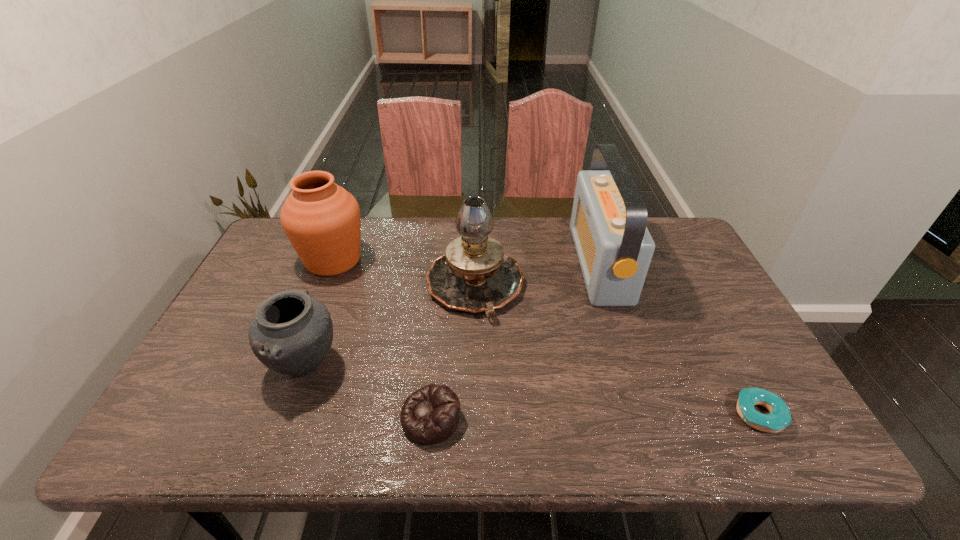
Find the location of `doughnut that is at the near edge`. doughnut that is at the near edge is located at coordinates (779, 417).

At what (x,y) coordinates should I click in order to perform the action: click on object that is at the left edge. Please return your answer as a coordinate pair (x, y). The width and height of the screenshot is (960, 540). Looking at the image, I should click on (322, 221).

Where is `object present at the right edge`? Image resolution: width=960 pixels, height=540 pixels. object present at the right edge is located at coordinates (779, 417).

At what (x,y) coordinates should I click in order to perform the action: click on object at the far left corner. Please return your answer as a coordinate pair (x, y). This screenshot has width=960, height=540. Looking at the image, I should click on (322, 221).

I want to click on object that is positioned at the near right corner, so click(779, 417).

Locate an element on the screen. vacant space at the far edge of the desktop is located at coordinates (456, 238).

In the image, there is a desktop. Where is `blank space at the near edge`? blank space at the near edge is located at coordinates (476, 451).

This screenshot has width=960, height=540. In order to click on free space at the right edge of the desktop in this screenshot , I will do `click(732, 307)`.

The width and height of the screenshot is (960, 540). Identify the location of vacant point at the near left corner. (203, 428).

In the image, there is a desktop. At what (x,y) coordinates should I click in order to perform the action: click on vacant space at the far right corner. Please return your answer as a coordinate pair (x, y). The height and width of the screenshot is (540, 960). Looking at the image, I should click on click(690, 251).